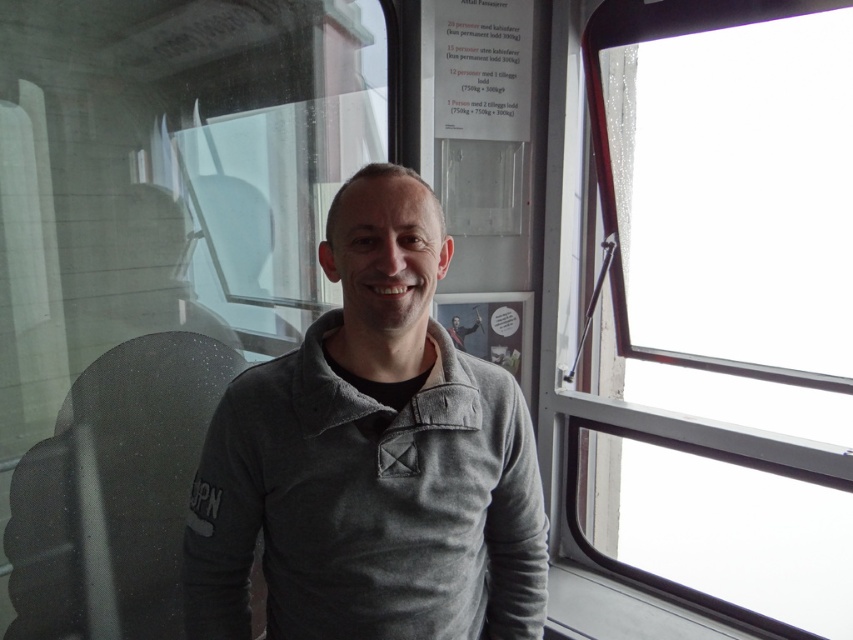
Question: Does clear glass window at right appear on the left side of gray fleece sweater at center?

Choices:
 (A) no
 (B) yes

Answer: (A)

Question: Which of the following is the farthest from the observer?

Choices:
 (A) (703, 492)
 (B) (509, 522)

Answer: (A)

Question: Which of the following is the closest to the observer?

Choices:
 (A) (300, 508)
 (B) (614, 388)

Answer: (A)

Question: Can you confirm if clear glass window at right is positioned to the right of gray fleece sweater at center?

Choices:
 (A) yes
 (B) no

Answer: (A)

Question: Is clear glass window at right further to the viewer compared to gray fleece sweater at center?

Choices:
 (A) yes
 (B) no

Answer: (A)